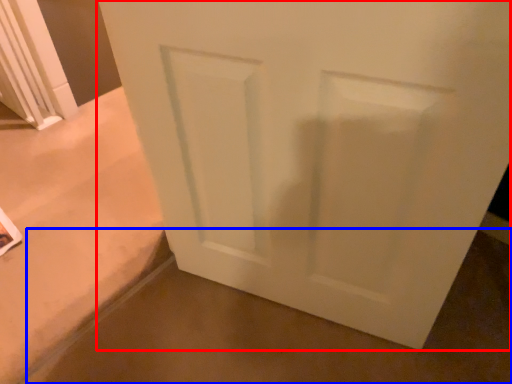
Question: Which object appears closest to the camera in this image, door (highlighted by a red box) or concrete (highlighted by a blue box)?

Choices:
 (A) door
 (B) concrete

Answer: (A)